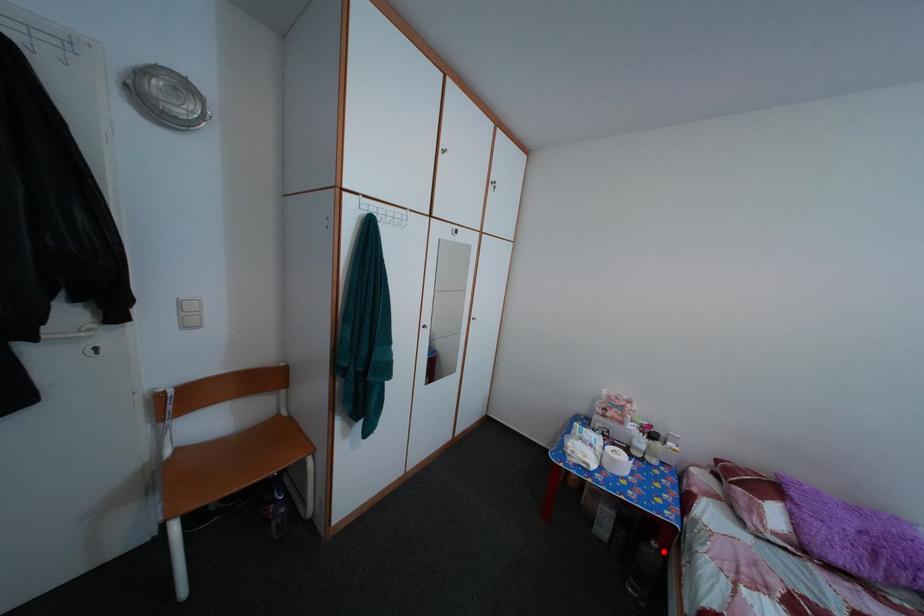
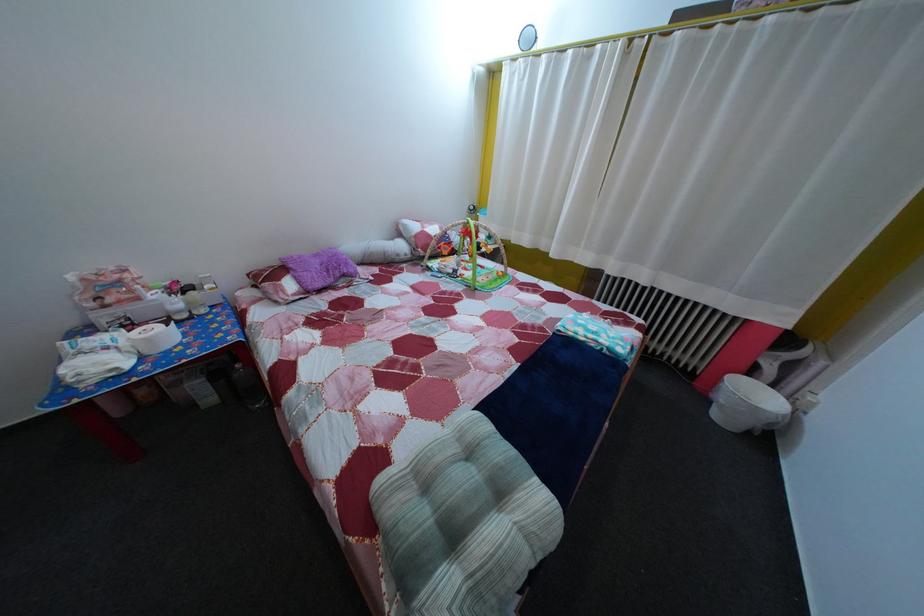
Question: I am providing you with two images of the same scene from different viewpoints. Image1 has a red point marked. In image2, the corresponding 3D location appears at what relative position? Reply with the corresponding letter.

Choices:
 (A) Closer
 (B) Farther

Answer: (B)